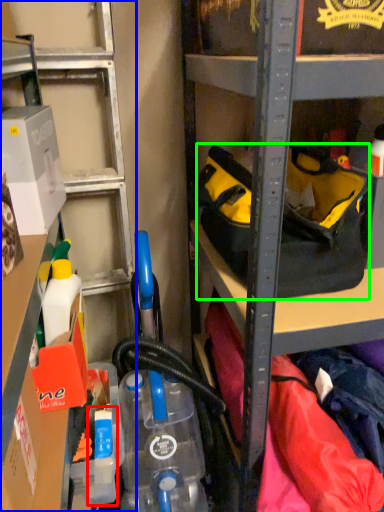
Question: Estimate the real-world distances between objects in this image. Which object is closer to bottle (highlighted by a red box), shelf (highlighted by a blue box) or handbag (highlighted by a green box)?

Choices:
 (A) shelf
 (B) handbag

Answer: (B)